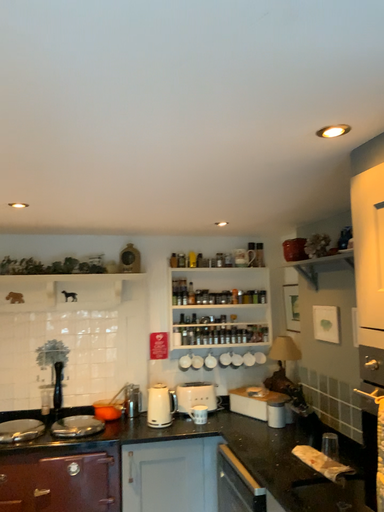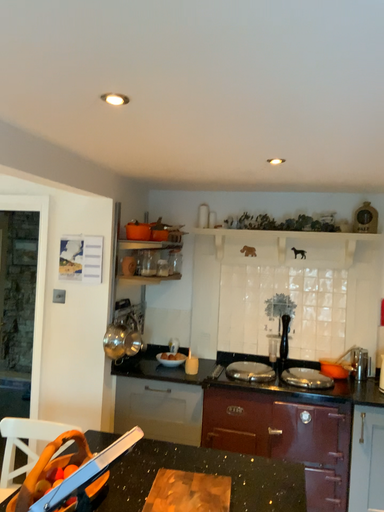
Question: Which way did the camera rotate in the video?

Choices:
 (A) rotated right
 (B) rotated left

Answer: (B)